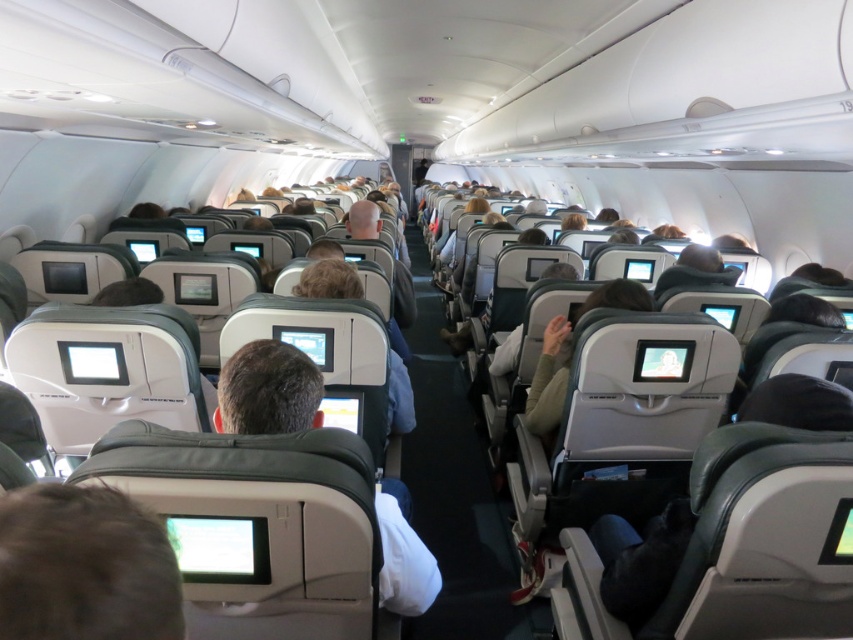
You are a flight attendant checking the cabin. You notice the dark brown hair at lower left and the matte gray seat at center. Which object is located to the left of the other?

The dark brown hair at lower left is positioned on the left side of matte gray seat at center.

You are a flight attendant carrying a 1 meter long tray. You need to walk down the aisle between the dark brown hair at lower left and the matte gray seat at center. Can you pass through without tilting the tray?

The distance between the dark brown hair at lower left and the matte gray seat at center is 80.79 centimeters. Since the tray is 1 meter long, it would not fit within the space, so you cannot pass through without tilting the tray.